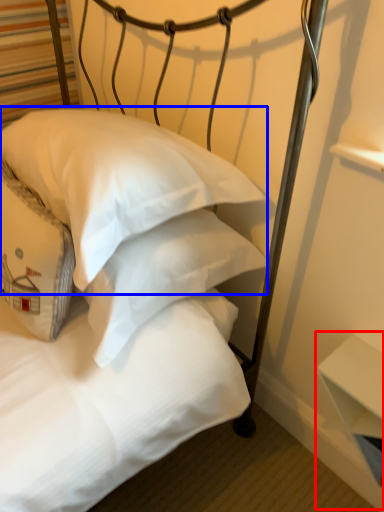
Question: Which point is closer to the camera, table (highlighted by a red box) or pillow (highlighted by a blue box)?

Choices:
 (A) table
 (B) pillow

Answer: (B)